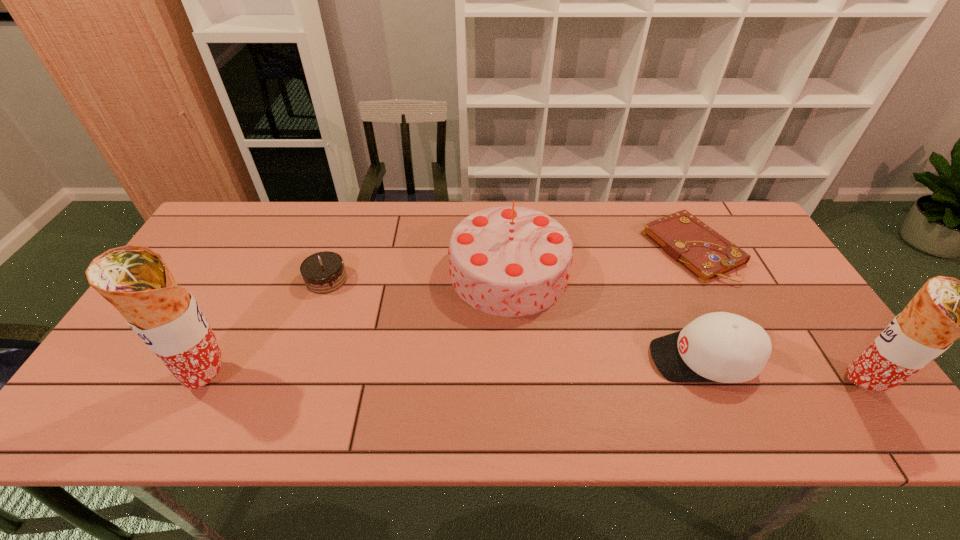
Identify the location of the leftmost object. The width and height of the screenshot is (960, 540). (134, 279).

Locate an element on the screen. the left burrito is located at coordinates (134, 279).

The width and height of the screenshot is (960, 540). I want to click on the shorter burrito, so click(944, 309).

Where is `the rightmost object`? This screenshot has height=540, width=960. the rightmost object is located at coordinates (944, 309).

Identify the location of the second object from left to right. The image size is (960, 540). (324, 272).

Where is `the second shortest object`? the second shortest object is located at coordinates [x=324, y=272].

Identify the location of notebook. This screenshot has height=540, width=960. (705, 253).

You are a GUI agent. You are given a task and a screenshot of the screen. Output one action in this format:
    pyautogui.click(x=<x>, y=<y>)
    Task: Click on the birthday cake
    
    Given the screenshot: What is the action you would take?
    pyautogui.click(x=511, y=261)

The height and width of the screenshot is (540, 960). What are the coordinates of `the third tallest object` in the screenshot? It's located at (511, 261).

At what (x,y) coordinates should I click in order to perform the action: click on baseball cap. Please return your answer as a coordinate pair (x, y). The height and width of the screenshot is (540, 960). Looking at the image, I should click on (x=724, y=347).